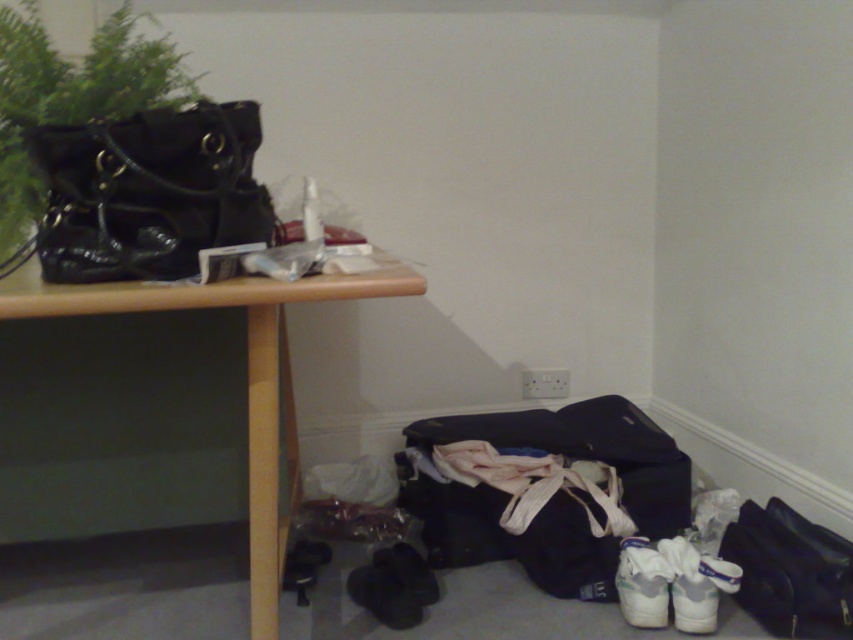
Question: Which of these objects is positioned closest to the black leather handbag at upper left?

Choices:
 (A) green matte plant at upper left
 (B) wooden table at upper left

Answer: (B)

Question: Does black leather handbag at upper left have a lesser width compared to wooden table at upper left?

Choices:
 (A) no
 (B) yes

Answer: (B)

Question: Is wooden table at upper left above green matte plant at upper left?

Choices:
 (A) yes
 (B) no

Answer: (B)

Question: Which point appears closest to the camera in this image?

Choices:
 (A) (6, 305)
 (B) (12, 140)
 (C) (225, 134)

Answer: (A)

Question: Estimate the real-world distances between objects in this image. Which object is closer to the wooden table at upper left?

Choices:
 (A) black leather handbag at upper left
 (B) green matte plant at upper left

Answer: (A)

Question: Is black leather handbag at upper left positioned at the back of green matte plant at upper left?

Choices:
 (A) yes
 (B) no

Answer: (B)